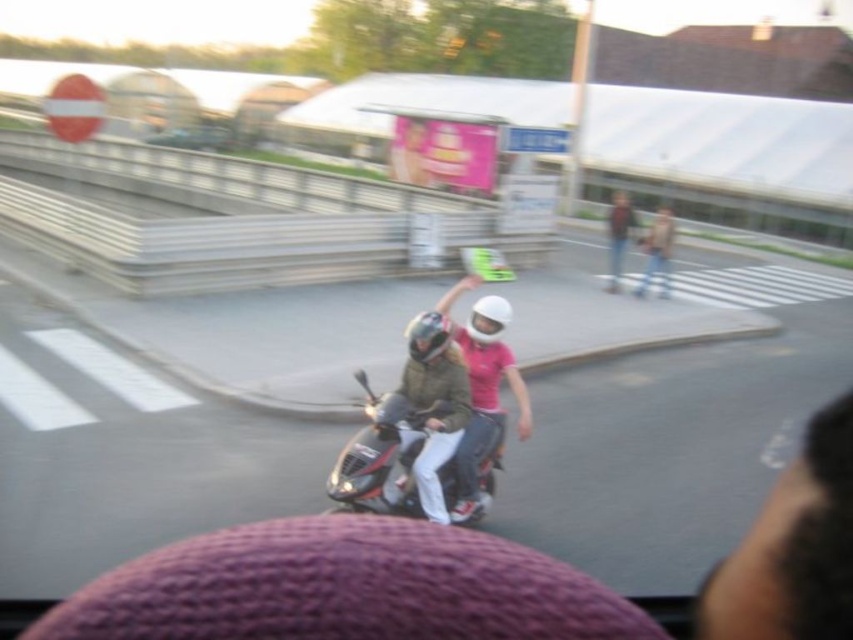
Can you confirm if shiny metallic scooter at center is positioned below matte white helmet at center?

Yes, shiny metallic scooter at center is below matte white helmet at center.

Is point (387, 492) positioned before point (456, 464)?

Yes, it is in front of point (456, 464).

The width and height of the screenshot is (853, 640). What do you see at coordinates (381, 456) in the screenshot?
I see `shiny metallic scooter at center` at bounding box center [381, 456].

At what (x,y) coordinates should I click in order to perform the action: click on shiny metallic scooter at center. Please return your answer as a coordinate pair (x, y). This screenshot has height=640, width=853. Looking at the image, I should click on (381, 456).

Can you confirm if matte white helmet at center is bigger than light brown leather jacket at upper right?

No.

Based on the photo, who is higher up, matte white helmet at center or light brown leather jacket at upper right?

light brown leather jacket at upper right is higher up.

Identify the location of matte white helmet at center. (485, 396).

Identify the location of matte white helmet at center. The height and width of the screenshot is (640, 853). (485, 396).

Which is behind, point (393, 452) or point (648, 240)?

Positioned behind is point (648, 240).

How distant is shiny metallic scooter at center from light brown leather jacket at upper right?

The distance of shiny metallic scooter at center from light brown leather jacket at upper right is 10.02 meters.

What do you see at coordinates (381, 456) in the screenshot? I see `shiny metallic scooter at center` at bounding box center [381, 456].

Locate an element on the screen. The width and height of the screenshot is (853, 640). shiny metallic scooter at center is located at coordinates (381, 456).